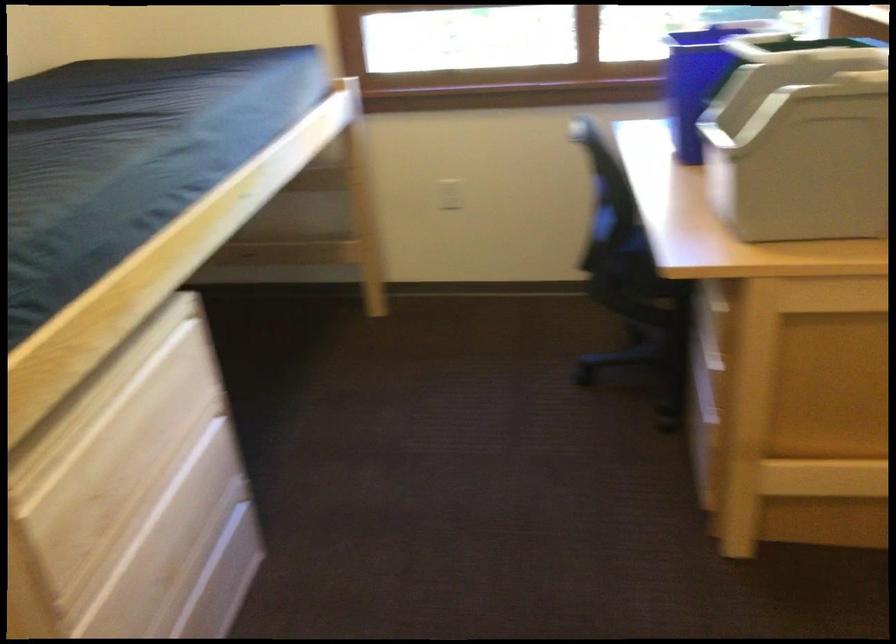
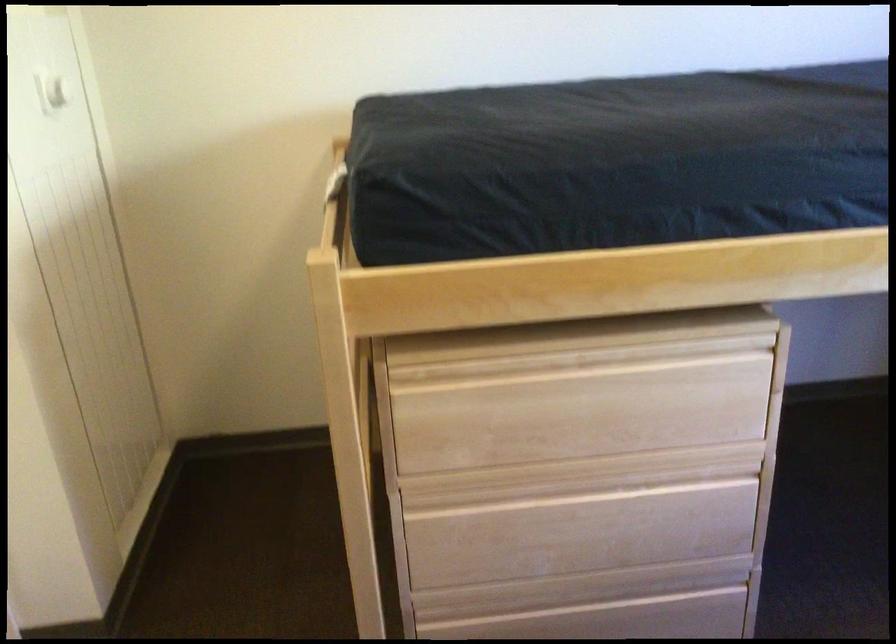
The point at (140,527) is marked in the first image. Where is the corresponding point in the second image?

(546, 491)